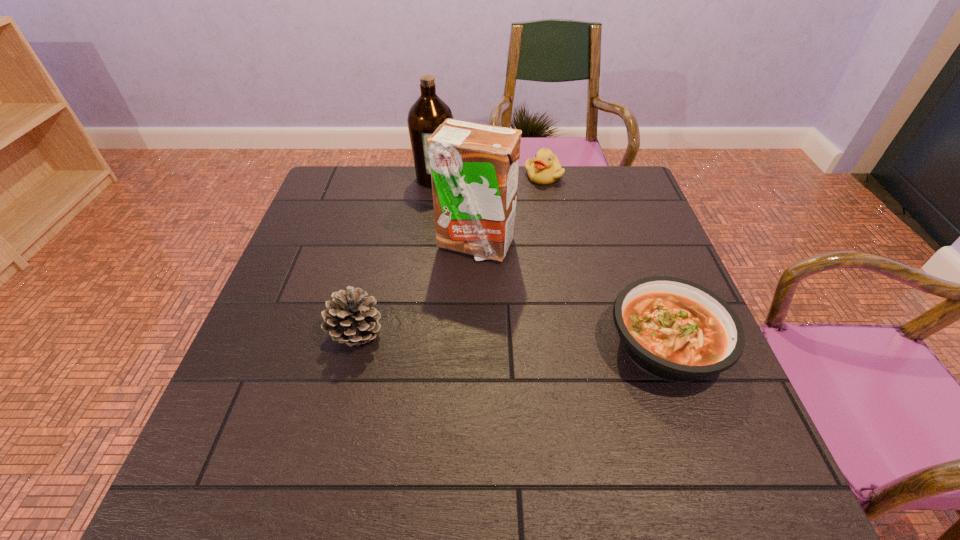
Identify the location of object that is at the right edge. This screenshot has width=960, height=540. (673, 329).

Locate an element on the screen. This screenshot has height=540, width=960. object that is at the near right corner is located at coordinates (673, 329).

Locate an element on the screen. The width and height of the screenshot is (960, 540). free space at the far edge of the desktop is located at coordinates (419, 189).

Identify the location of free spot at the near edge of the desktop. The width and height of the screenshot is (960, 540). (414, 412).

Image resolution: width=960 pixels, height=540 pixels. In the image, there is a desktop. What are the coordinates of `vacant space at the left edge` in the screenshot? It's located at (335, 236).

This screenshot has height=540, width=960. Identify the location of vacant space at the right edge of the desktop. (659, 244).

Find the location of a particular element. Image resolution: width=960 pixels, height=540 pixels. vacant space at the far left corner of the desktop is located at coordinates (369, 197).

Image resolution: width=960 pixels, height=540 pixels. In the image, there is a desktop. In order to click on vacant space at the far right corner in this screenshot , I will do `click(588, 185)`.

Image resolution: width=960 pixels, height=540 pixels. Find the location of `vacant region between the third shortest object and the third farthest object`. vacant region between the third shortest object and the third farthest object is located at coordinates (416, 288).

You are a GUI agent. You are given a task and a screenshot of the screen. Output one action in this format:
    pyautogui.click(x=<x>, y=<y>)
    Task: Click on the blank region between the duckling and the rightmost object
    The height and width of the screenshot is (540, 960).
    Given the screenshot: What is the action you would take?
    pyautogui.click(x=605, y=261)